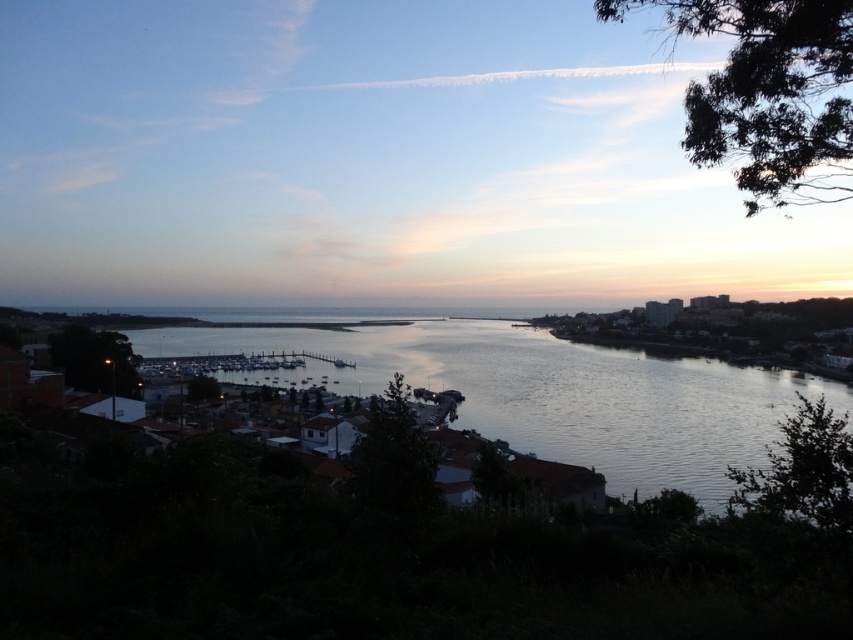
From the picture: You are standing at the edge of a cliff overlooking the scene. Which object, the pastel sky at center or the silvery water at center, would appear closer to you if you look straight ahead?

The pastel sky at center appears closer to you because it is further to the viewer than the silvery water at center.

In the scene shown: You are an artist planning to paint the coastal scene. You need to decide which area to focus on first based on their sizes. Which object should you paint first, the pastel sky at center or the silvery water at center?

The pastel sky at center is bigger than the silvery water at center, so you should paint the pastel sky at center first to capture its larger presence in the scene.